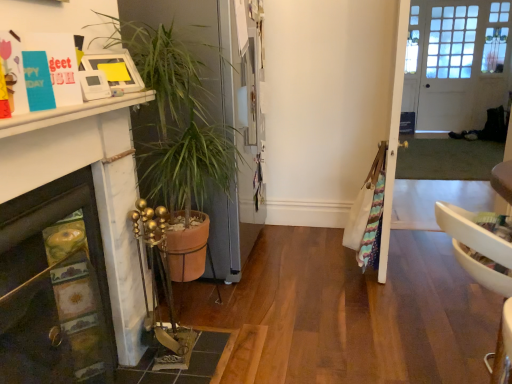
Question: Considering the relative sizes of white wooden door at upper right and clear glass door at center in the image provided, is white wooden door at upper right smaller than clear glass door at center?

Choices:
 (A) yes
 (B) no

Answer: (A)

Question: Is white wooden door at upper right to the left of clear glass door at center from the viewer's perspective?

Choices:
 (A) no
 (B) yes

Answer: (A)

Question: From the image's perspective, is white wooden door at upper right over clear glass door at center?

Choices:
 (A) no
 (B) yes

Answer: (B)

Question: Is white wooden door at upper right positioned behind clear glass door at center?

Choices:
 (A) yes
 (B) no

Answer: (A)

Question: Can you confirm if white wooden door at upper right is shorter than clear glass door at center?

Choices:
 (A) no
 (B) yes

Answer: (A)

Question: From a real-world perspective, is marble fireplace at lower left positioned above or below clear glass door at center?

Choices:
 (A) below
 (B) above

Answer: (A)

Question: In terms of width, does marble fireplace at lower left look wider or thinner when compared to clear glass door at center?

Choices:
 (A) thin
 (B) wide

Answer: (A)

Question: Which is correct: marble fireplace at lower left is inside clear glass door at center, or outside of it?

Choices:
 (A) outside
 (B) inside

Answer: (A)

Question: Would you say marble fireplace at lower left is to the left or to the right of clear glass door at center in the picture?

Choices:
 (A) right
 (B) left

Answer: (B)

Question: From the image's perspective, is matte brown tile at lower left above or below white wooden door at upper right?

Choices:
 (A) below
 (B) above

Answer: (A)

Question: Is matte brown tile at lower left spatially inside white wooden door at upper right, or outside of it?

Choices:
 (A) outside
 (B) inside

Answer: (A)

Question: Is matte brown tile at lower left bigger or smaller than white wooden door at upper right?

Choices:
 (A) big
 (B) small

Answer: (B)

Question: Based on their positions, is matte brown tile at lower left located to the left or right of white wooden door at upper right?

Choices:
 (A) left
 (B) right

Answer: (A)

Question: In terms of size, does clear glass door at center appear bigger or smaller than white wooden door at upper right?

Choices:
 (A) small
 (B) big

Answer: (B)

Question: Is clear glass door at center wider or thinner than white wooden door at upper right?

Choices:
 (A) wide
 (B) thin

Answer: (A)